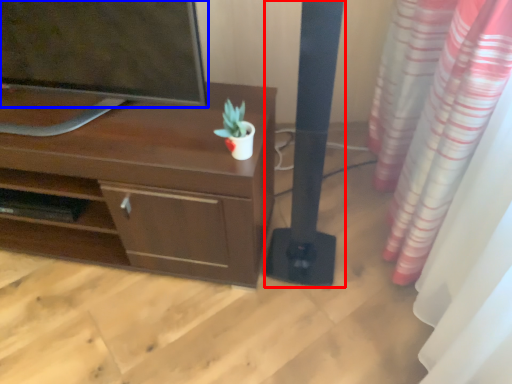
Question: Among these objects, which one is farthest to the camera, pillar (highlighted by a red box) or television (highlighted by a blue box)?

Choices:
 (A) pillar
 (B) television

Answer: (B)